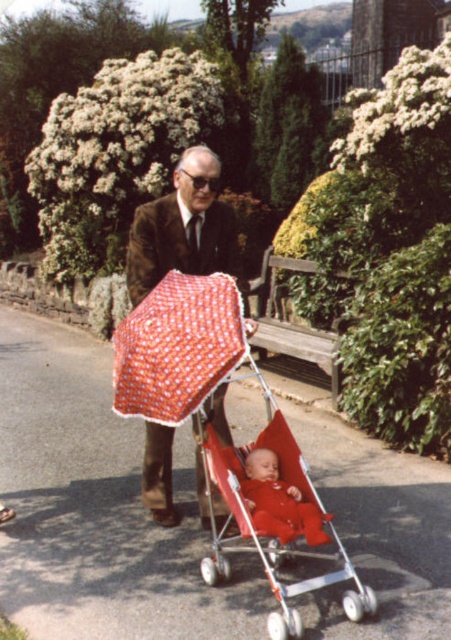
Does point (207, 276) come behind point (193, 218)?

That is False.

Does red polka dot fabric umbrella at center have a greater height compared to brown woolen suit at center?

In fact, red polka dot fabric umbrella at center may be shorter than brown woolen suit at center.

Where is `red polka dot fabric umbrella at center`? The image size is (451, 640). red polka dot fabric umbrella at center is located at coordinates (178, 348).

Who is more forward, (x=184, y=156) or (x=308, y=556)?

Point (x=308, y=556)

Who is shorter, brown woolen suit at center or red fabric stroller at center?

With less height is brown woolen suit at center.

Is point (150, 266) in front of point (281, 611)?

No, (150, 266) is further to viewer.

At what (x,y) coordinates should I click in order to perform the action: click on brown woolen suit at center. Please return your answer as a coordinate pair (x, y). This screenshot has height=640, width=451. Looking at the image, I should click on (183, 227).

Can you confirm if red polka dot fabric umbrella at center is positioned above red fabric stroller at center?

Yes, red polka dot fabric umbrella at center is above red fabric stroller at center.

Describe the element at coordinates (178, 348) in the screenshot. The height and width of the screenshot is (640, 451). I see `red polka dot fabric umbrella at center` at that location.

The height and width of the screenshot is (640, 451). In order to click on red polka dot fabric umbrella at center in this screenshot , I will do `click(178, 348)`.